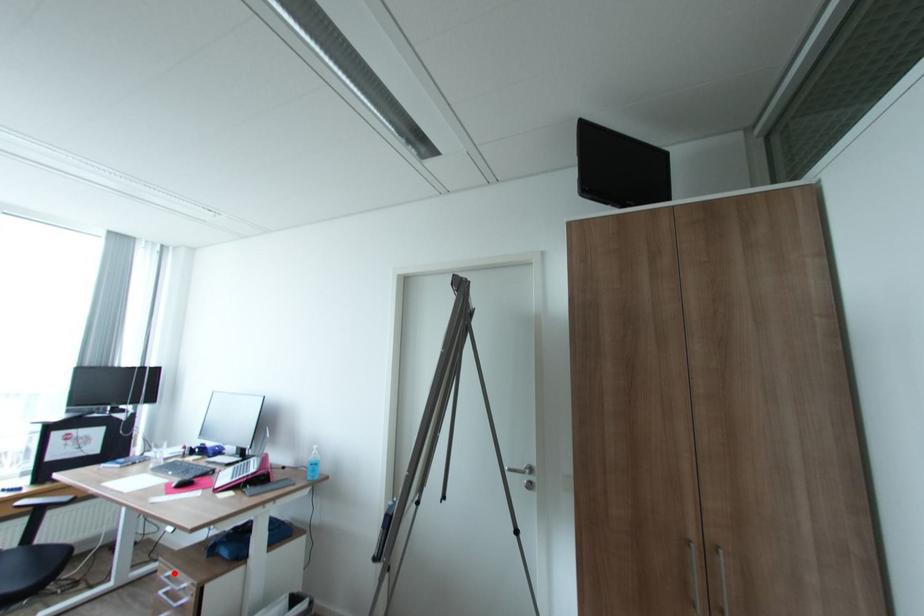
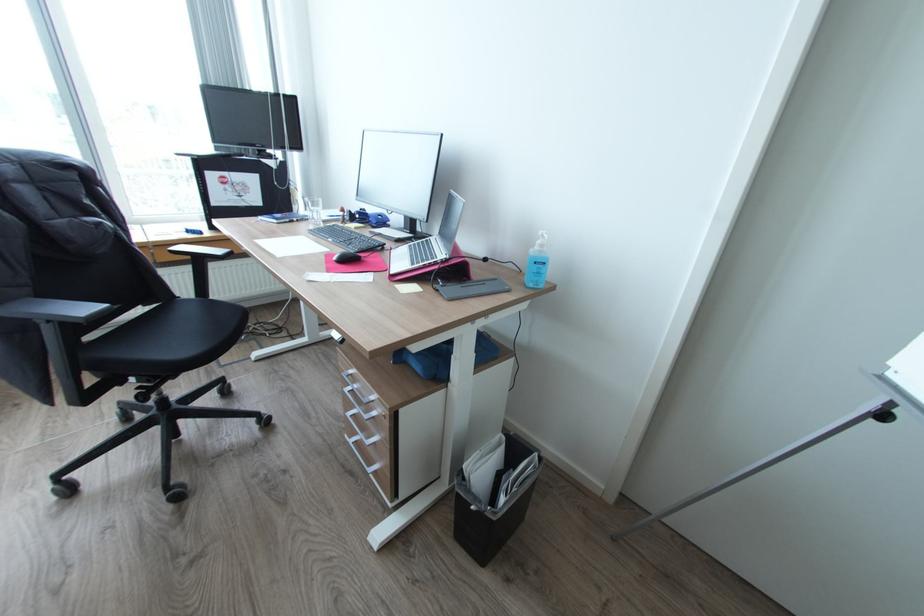
Find the pixel in the second image that matches the highlighted location in the first image.

(357, 371)